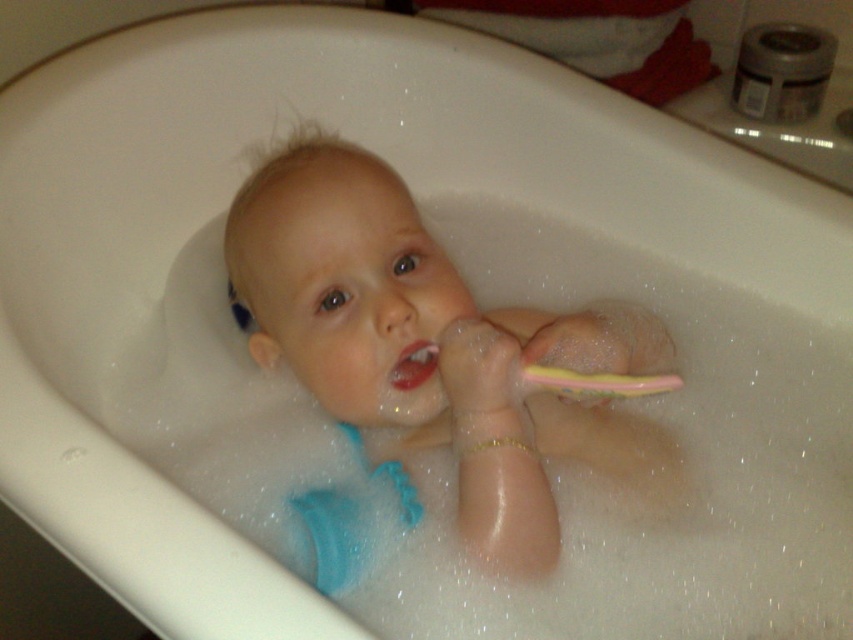
The baby is holding two toothbrushes in the bathtub. Which toothbrush is taller, the smooth plastic toothbrush at center or the yellow rubber toothbrush at upper center?

The smooth plastic toothbrush at center is much taller than the yellow rubber toothbrush at upper center.

You are a parent trying to choose a toothbrush for your baby. You see the smooth plastic toothbrush at center and the pink rubber toothbrush at upper center in the bathtub. Which toothbrush is taller?

The smooth plastic toothbrush at center is taller than the pink rubber toothbrush at upper center.